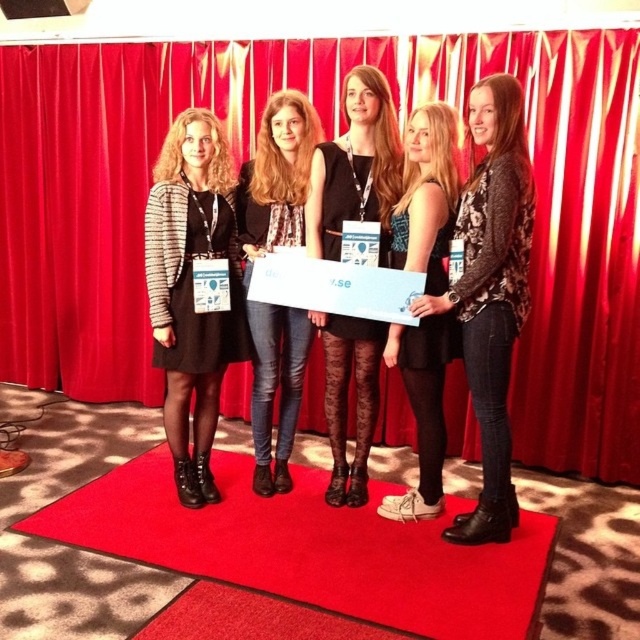
Does red carpet at center appear on the right side of matte black jacket at center?

Yes, red carpet at center is to the right of matte black jacket at center.

Does red carpet at center appear on the left side of matte black jacket at center?

Incorrect, red carpet at center is not on the left side of matte black jacket at center.

At what (x,y) coordinates should I click in order to perform the action: click on red carpet at center. Please return your answer as a coordinate pair (x, y). Image resolution: width=640 pixels, height=640 pixels. Looking at the image, I should click on (308, 547).

Between red carpet at center and matte black dress at center, which one has less height?

Standing shorter between the two is red carpet at center.

The height and width of the screenshot is (640, 640). What do you see at coordinates (308, 547) in the screenshot?
I see `red carpet at center` at bounding box center [308, 547].

Locate an element on the screen. red carpet at center is located at coordinates (308, 547).

Consider the image. Can you confirm if matte black dress at left is shorter than patterned sweater at center?

Correct, matte black dress at left is not as tall as patterned sweater at center.

Is matte black dress at left smaller than patterned sweater at center?

Yes, matte black dress at left is smaller than patterned sweater at center.

Describe the element at coordinates (193, 289) in the screenshot. The width and height of the screenshot is (640, 640). I see `matte black dress at left` at that location.

Image resolution: width=640 pixels, height=640 pixels. In order to click on matte black dress at left in this screenshot , I will do `click(193, 289)`.